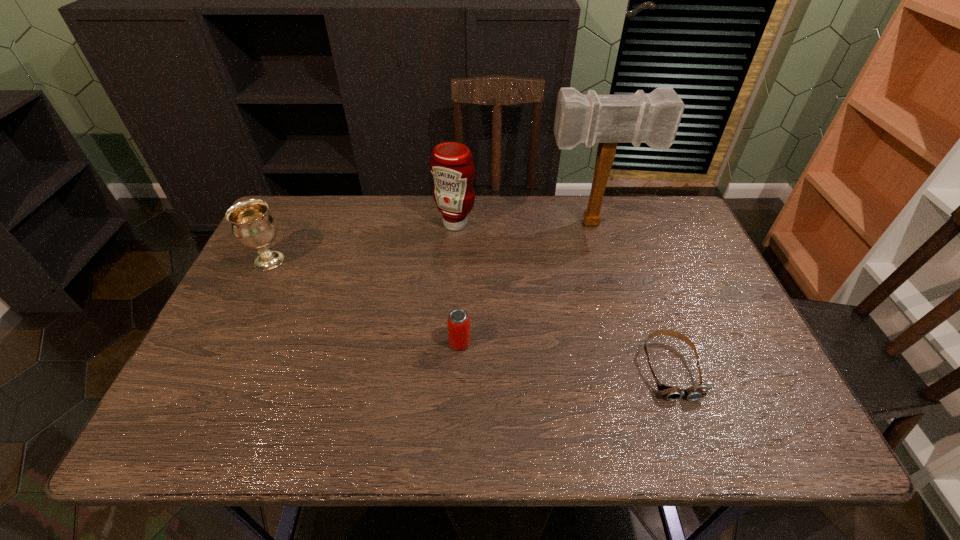
The width and height of the screenshot is (960, 540). I want to click on free region at the right edge, so click(695, 269).

In the image, there is a desktop. Identify the location of vacant space at the far left corner. This screenshot has height=540, width=960. (317, 235).

The image size is (960, 540). Identify the location of blank space at the far right corner. (648, 200).

The height and width of the screenshot is (540, 960). I want to click on free space between the mallet and the condiment, so coord(524,224).

Where is `vacant area that lies between the fourth tallest object and the mallet`? The height and width of the screenshot is (540, 960). vacant area that lies between the fourth tallest object and the mallet is located at coordinates (526, 284).

Where is `free space between the third nearest object and the condiment`? free space between the third nearest object and the condiment is located at coordinates (362, 242).

Locate an element on the screen. This screenshot has height=540, width=960. free spot between the tallest object and the goggles is located at coordinates (632, 296).

The width and height of the screenshot is (960, 540). What are the coordinates of `free spot between the shortest object and the tallest object` in the screenshot? It's located at (632, 296).

Where is `vacant area that lies between the tallest object and the beer can`? vacant area that lies between the tallest object and the beer can is located at coordinates (526, 284).

This screenshot has height=540, width=960. What are the coordinates of `vacant space that's between the leftmost object and the beer can` in the screenshot? It's located at (365, 302).